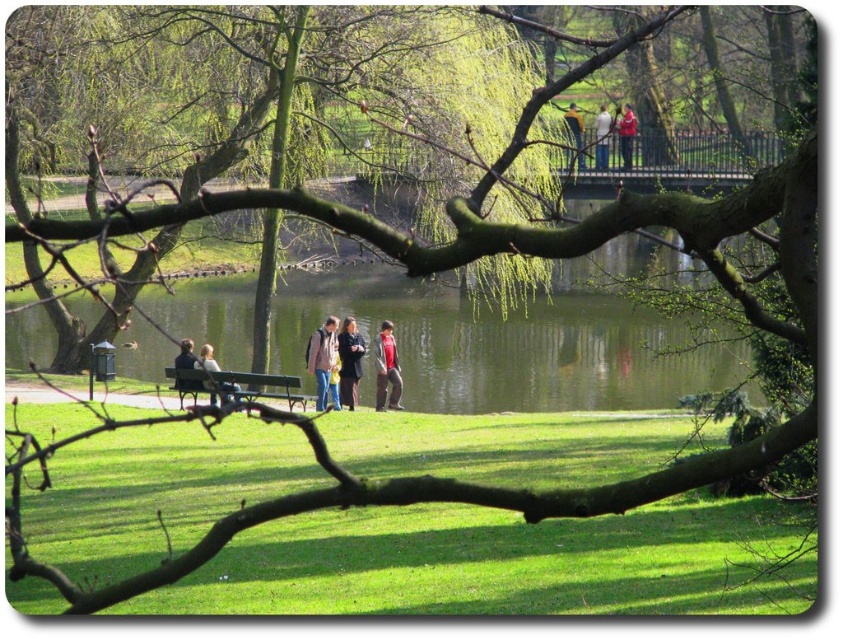
From the picture: You are standing at the origin point of the coordinate system in the image. The origin is at the bottom left corner of the image. You want to find the matte brown jacket at center. In which direction should you move relative to the origin to reach it?

Since the origin is at the bottom left corner of the image and the matte brown jacket at center is located at point [321,358], you should move to the right and upwards from the origin to reach it.

From the picture: You are standing at the camera position and want to throw a pebble to the matte brown jacket at center. Can you reach it with a single throw?

The distance between the matte brown jacket at center and the camera is 26.67 meters, so it is unlikely you can reach it with a single throw as the average throwing distance for a pebble is around 20 meters.

You are a park visitor who wants to borrow a jacket from either the red fabric jacket at center or the light brown leather jacket at center. Which jacket would be more suitable for a windy day?

The light brown leather jacket at center is thicker than the red fabric jacket at center, so it would be more suitable for a windy day.